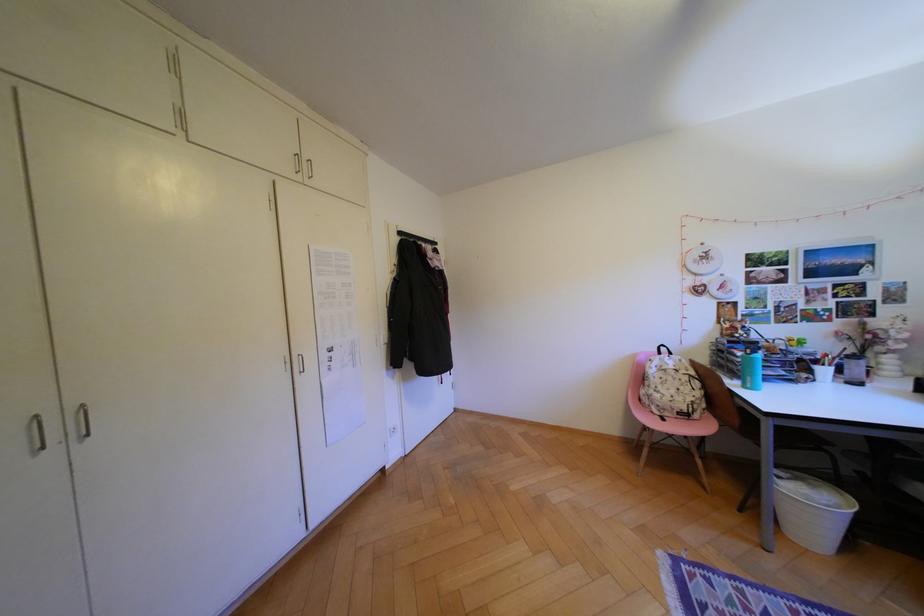
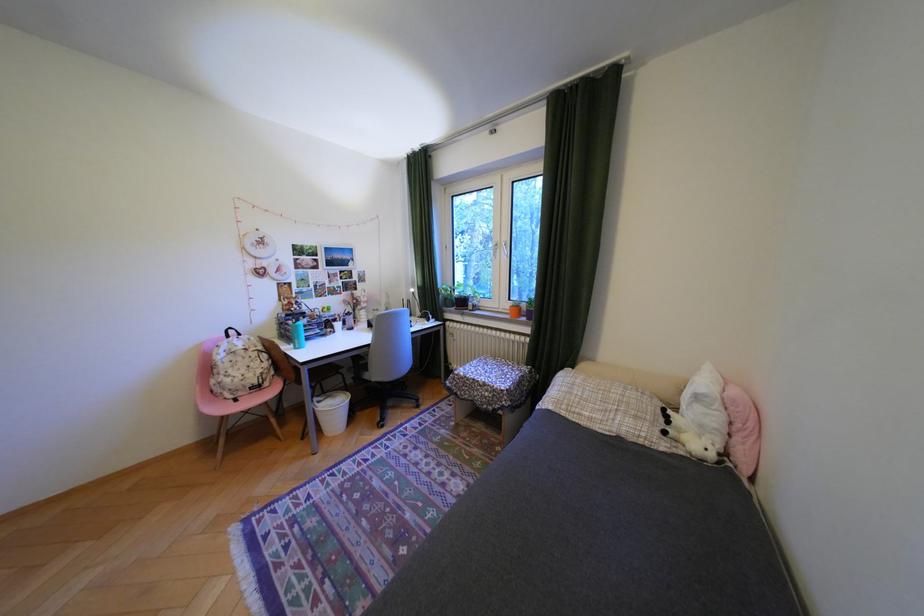
In the second image, find the point that corresponds to (x=669, y=395) in the first image.

(239, 379)